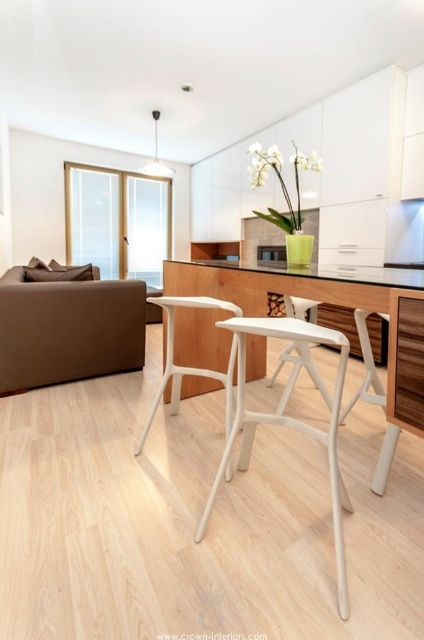
Can you confirm if white plastic table at center is positioned below white plastic bar stool at center?

No, white plastic table at center is not below white plastic bar stool at center.

Is white plastic table at center thinner than white plastic bar stool at center?

No, white plastic table at center is not thinner than white plastic bar stool at center.

Which is in front, point (396, 284) or point (240, 344)?

Point (240, 344) is more forward.

This screenshot has width=424, height=640. I want to click on white plastic table at center, so click(286, 284).

Which is above, brown leather couch at left or white plastic bar stool at center?

brown leather couch at left

Locate an element on the screen. Image resolution: width=424 pixels, height=640 pixels. brown leather couch at left is located at coordinates (67, 330).

Based on the photo, can you confirm if brown leather couch at left is positioned below white plastic table at center?

No, brown leather couch at left is not below white plastic table at center.

Is brown leather couch at left positioned behind white plastic table at center?

Yes.

Is point (116, 289) less distant than point (254, 371)?

No, (116, 289) is behind (254, 371).

The height and width of the screenshot is (640, 424). Find the location of `brown leather couch at left`. brown leather couch at left is located at coordinates (67, 330).